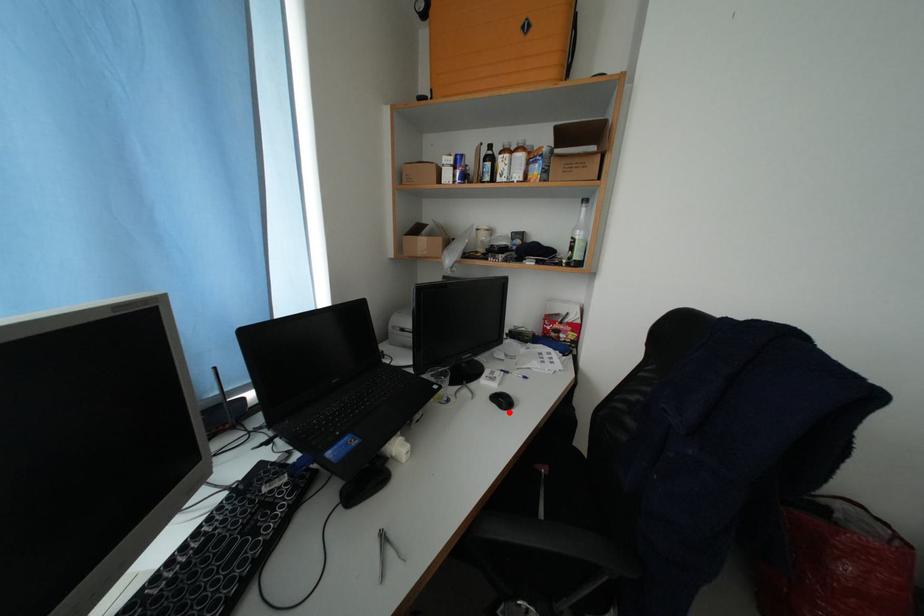
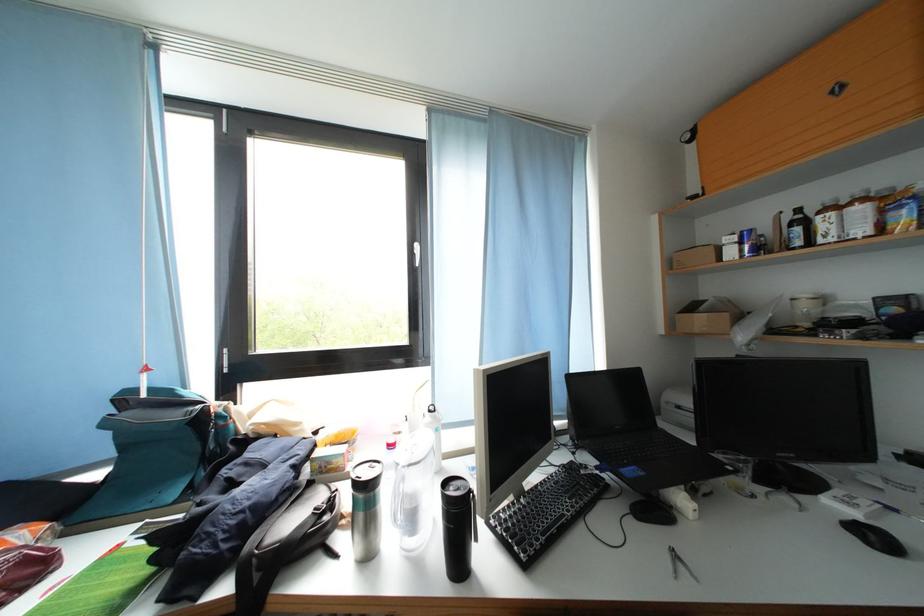
Question: I am providing you with two images of the same scene from different viewpoints. Given a red point in image1, look at the same physical point in image2. Is it:

Choices:
 (A) Closer to the viewpoint
 (B) Farther from the viewpoint

Answer: (A)